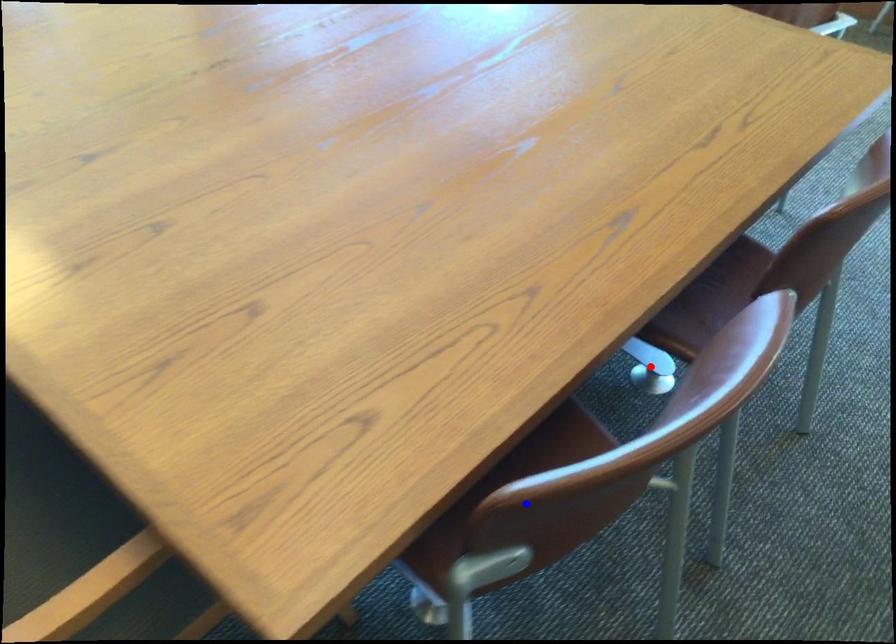
Question: In the image, two points are highlighted. Which point is nearer to the camera? Reply with the corresponding letter.

Choices:
 (A) blue point
 (B) red point

Answer: (A)